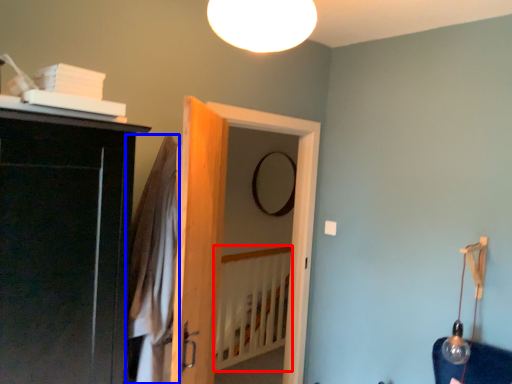
Question: Which of the following is the farthest to the observer, bed frame (highlighted by a red box) or robe (highlighted by a blue box)?

Choices:
 (A) bed frame
 (B) robe

Answer: (A)